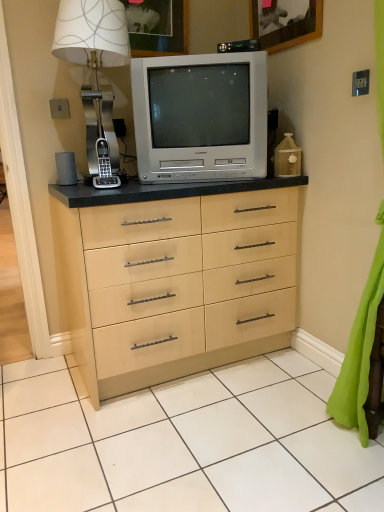
Question: Can you confirm if silver metallic television at center is shorter than wooden picture frame at upper center, the 2th picture frame when ordered from left to right?

Choices:
 (A) yes
 (B) no

Answer: (B)

Question: From the image's perspective, is silver metallic television at center beneath wooden picture frame at upper center, the 2th picture frame when ordered from left to right?

Choices:
 (A) no
 (B) yes

Answer: (B)

Question: From a real-world perspective, is silver metallic television at center located higher than wooden picture frame at upper center, the 2th picture frame when ordered from left to right?

Choices:
 (A) no
 (B) yes

Answer: (A)

Question: Does silver metallic television at center contain wooden picture frame at upper center, the 1th picture frame in the right-to-left sequence?

Choices:
 (A) no
 (B) yes

Answer: (A)

Question: Considering the relative sizes of silver metallic television at center and wooden picture frame at upper center, the 1th picture frame in the right-to-left sequence, in the image provided, is silver metallic television at center taller than wooden picture frame at upper center, the 1th picture frame in the right-to-left sequence,?

Choices:
 (A) no
 (B) yes

Answer: (B)

Question: From the image's perspective, is silver metallic television at center on top of wooden picture frame at upper center, the 1th picture frame in the right-to-left sequence?

Choices:
 (A) no
 (B) yes

Answer: (A)

Question: Can you confirm if matte white picture frame at upper center, placed as the 1th picture frame when sorted from left to right, is shorter than metallic silver table lamp at upper left?

Choices:
 (A) no
 (B) yes

Answer: (B)

Question: Would you say matte white picture frame at upper center, which is the 2th picture frame from right to left, contains metallic silver table lamp at upper left?

Choices:
 (A) no
 (B) yes

Answer: (A)

Question: From a real-world perspective, is matte white picture frame at upper center, placed as the 1th picture frame when sorted from left to right, positioned over metallic silver table lamp at upper left based on gravity?

Choices:
 (A) yes
 (B) no

Answer: (A)

Question: Considering the relative sizes of matte white picture frame at upper center, placed as the 1th picture frame when sorted from left to right, and metallic silver table lamp at upper left in the image provided, is matte white picture frame at upper center, placed as the 1th picture frame when sorted from left to right, taller than metallic silver table lamp at upper left?

Choices:
 (A) yes
 (B) no

Answer: (B)

Question: Considering the relative sizes of matte white picture frame at upper center, placed as the 1th picture frame when sorted from left to right, and metallic silver table lamp at upper left in the image provided, is matte white picture frame at upper center, placed as the 1th picture frame when sorted from left to right, wider than metallic silver table lamp at upper left?

Choices:
 (A) no
 (B) yes

Answer: (A)

Question: From a real-world perspective, is matte white picture frame at upper center, placed as the 1th picture frame when sorted from left to right, below metallic silver table lamp at upper left?

Choices:
 (A) yes
 (B) no

Answer: (B)

Question: Can you confirm if green fabric curtain at lower right is thinner than metallic silver table lamp at upper left?

Choices:
 (A) yes
 (B) no

Answer: (A)